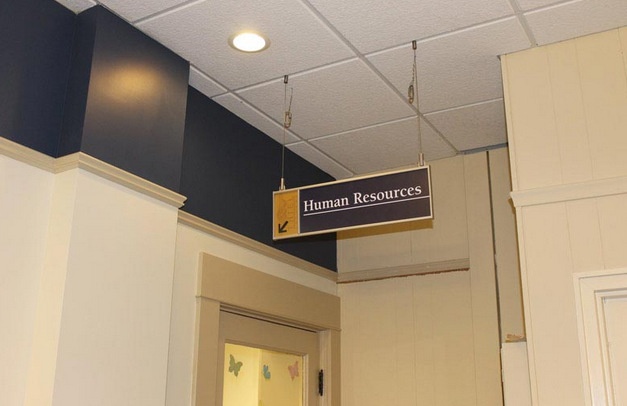
At what (x,y) coordinates should I click in order to perform the action: click on butterfly decals. Please return your answer as a coordinate pair (x, y). This screenshot has width=627, height=406. Looking at the image, I should click on (233, 366), (293, 371).